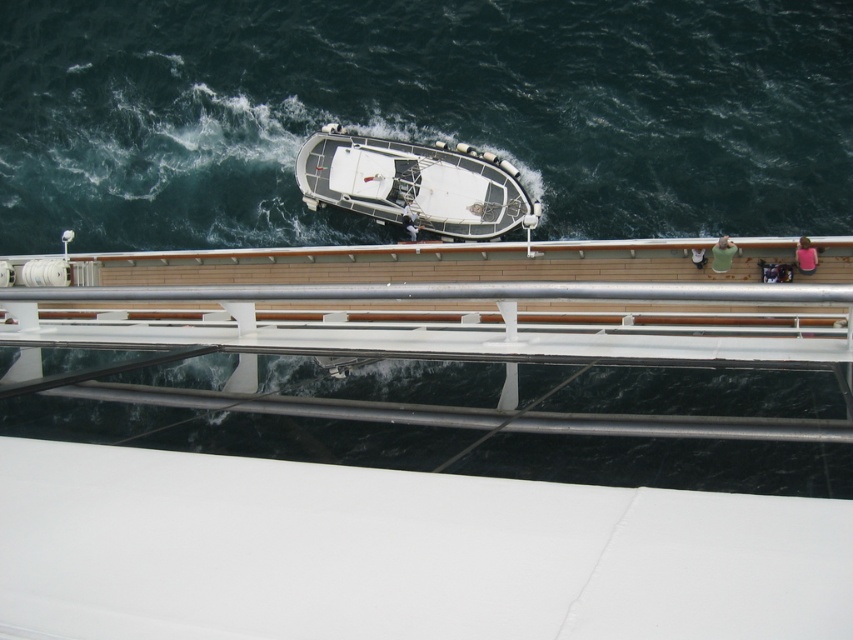
In the scene shown: Who is higher up, dark blue water at center or pink fabric at upper right?

dark blue water at center is above.

This screenshot has height=640, width=853. Identify the location of dark blue water at center. (421, 113).

At what (x,y) coordinates should I click in order to perform the action: click on dark blue water at center. Please return your answer as a coordinate pair (x, y). Looking at the image, I should click on (421, 113).

Is point (19, 76) farther from camera compared to point (351, 208)?

Yes, point (19, 76) is farther from viewer.

Is dark blue water at center bigger than white matte boat at center?

Indeed, dark blue water at center has a larger size compared to white matte boat at center.

Between point (387, 81) and point (438, 202), which one is positioned in front?

Point (438, 202) is in front.

Find the location of a particular element. This screenshot has height=640, width=853. dark blue water at center is located at coordinates click(x=421, y=113).

Is white matte boat at center in front of pink fabric at upper right?

No, white matte boat at center is further to the viewer.

Is white matte boat at center thinner than pink fabric at upper right?

Correct, white matte boat at center's width is less than pink fabric at upper right's.

Who is more distant from viewer, (519,212) or (802,236)?

The point (519,212) is more distant.

Identify the location of white matte boat at center. (415, 182).